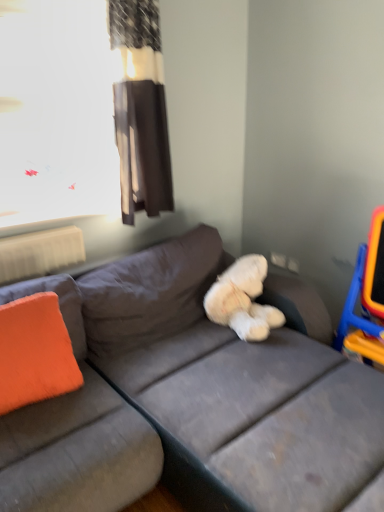
Question: Can you confirm if orange plastic swivel chair at right is shorter than orange fabric pillow at left?

Choices:
 (A) yes
 (B) no

Answer: (B)

Question: Is orange fabric pillow at left inside orange plastic swivel chair at right?

Choices:
 (A) yes
 (B) no

Answer: (B)

Question: Does orange plastic swivel chair at right have a greater width compared to orange fabric pillow at left?

Choices:
 (A) yes
 (B) no

Answer: (A)

Question: From a real-world perspective, is orange plastic swivel chair at right on top of orange fabric pillow at left?

Choices:
 (A) yes
 (B) no

Answer: (B)

Question: From the image's perspective, is orange plastic swivel chair at right over orange fabric pillow at left?

Choices:
 (A) yes
 (B) no

Answer: (A)

Question: Is orange plastic swivel chair at right not near orange fabric pillow at left?

Choices:
 (A) yes
 (B) no

Answer: (A)

Question: Is transparent plastic window screen at upper left not close to orange fabric pillow at left?

Choices:
 (A) yes
 (B) no

Answer: (A)

Question: Can you confirm if transparent plastic window screen at upper left is shorter than orange fabric pillow at left?

Choices:
 (A) yes
 (B) no

Answer: (B)

Question: Is transparent plastic window screen at upper left thinner than orange fabric pillow at left?

Choices:
 (A) no
 (B) yes

Answer: (B)

Question: Is orange fabric pillow at left surrounded by transparent plastic window screen at upper left?

Choices:
 (A) yes
 (B) no

Answer: (B)

Question: Can you confirm if transparent plastic window screen at upper left is smaller than orange fabric pillow at left?

Choices:
 (A) yes
 (B) no

Answer: (B)

Question: Is the position of transparent plastic window screen at upper left more distant than that of orange fabric pillow at left?

Choices:
 (A) yes
 (B) no

Answer: (A)

Question: Is gray fabric couch at center not inside orange plastic swivel chair at right?

Choices:
 (A) no
 (B) yes

Answer: (B)